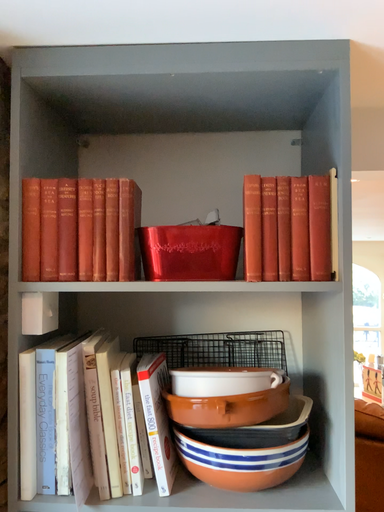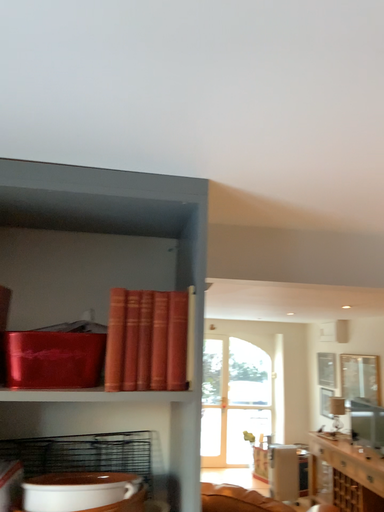
Question: Which way did the camera rotate in the video?

Choices:
 (A) rotated upward
 (B) rotated downward

Answer: (A)